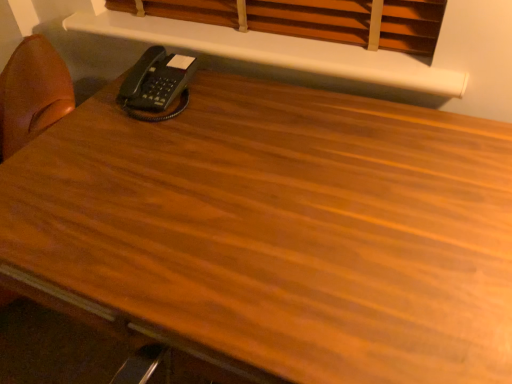
At what (x,y) coordinates should I click in order to perform the action: click on free point in front of black plastic phone at upper left. Please return your answer as a coordinate pair (x, y). Looking at the image, I should click on (147, 133).